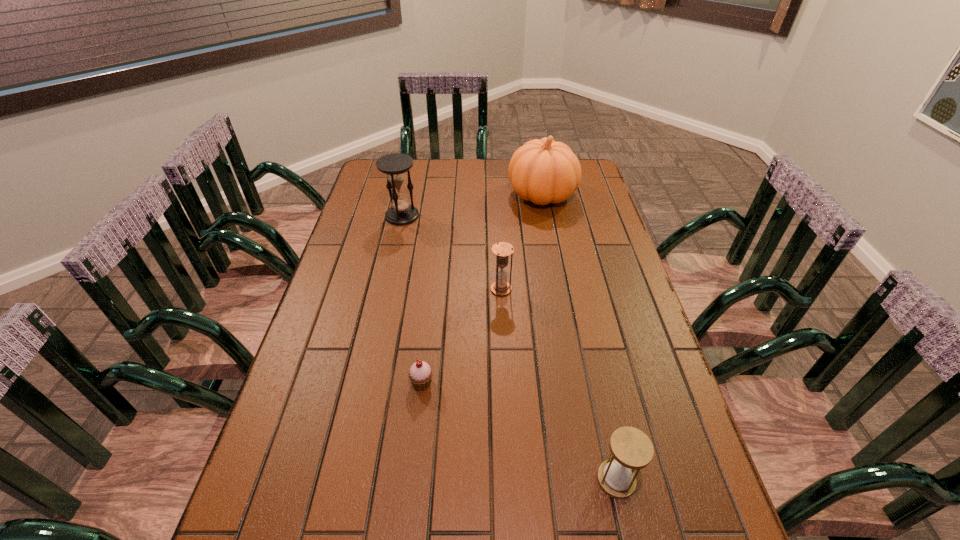
I want to click on free space at the left edge, so click(x=306, y=423).

Image resolution: width=960 pixels, height=540 pixels. In the image, there is a desktop. Find the location of `free space at the right edge`. free space at the right edge is located at coordinates (613, 291).

Find the location of a particular element. This screenshot has width=960, height=540. vacant space at the far right corner of the desktop is located at coordinates (593, 171).

The height and width of the screenshot is (540, 960). Find the location of `empty location between the pumpkin and the second nearest object`. empty location between the pumpkin and the second nearest object is located at coordinates (482, 289).

Identify the location of empty space that is in between the pumpkin and the rightmost hourglass. (579, 337).

Locate an element on the screen. Image resolution: width=960 pixels, height=540 pixels. vacant point located between the shortest object and the nearest hourglass is located at coordinates [x=518, y=431].

The width and height of the screenshot is (960, 540). In order to click on vacant space in between the rightmost hourglass and the leftmost hourglass in this screenshot , I will do `click(509, 348)`.

What are the coordinates of `unoccupied area between the shortest object and the pumpkin` in the screenshot? It's located at click(482, 289).

Where is `empty space that is in between the cupcake and the tallest hourglass`? This screenshot has width=960, height=540. empty space that is in between the cupcake and the tallest hourglass is located at coordinates (412, 300).

Locate an element on the screen. The width and height of the screenshot is (960, 540). free point between the leftmost object and the pumpkin is located at coordinates (472, 205).